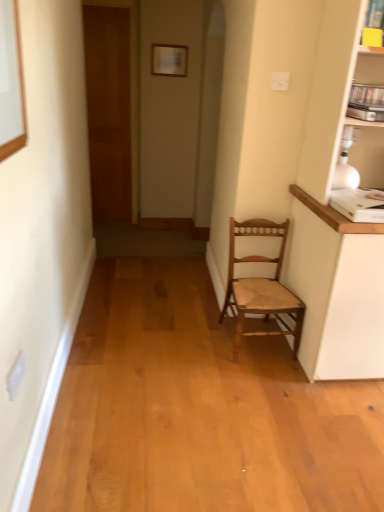
You are a GUI agent. You are given a task and a screenshot of the screen. Output one action in this format:
    pyautogui.click(x=<x>, y=<y>)
    Task: Click on the vacant region to the left of wooden chair at center
    The image size is (384, 512).
    Given the screenshot: What is the action you would take?
    pyautogui.click(x=201, y=342)